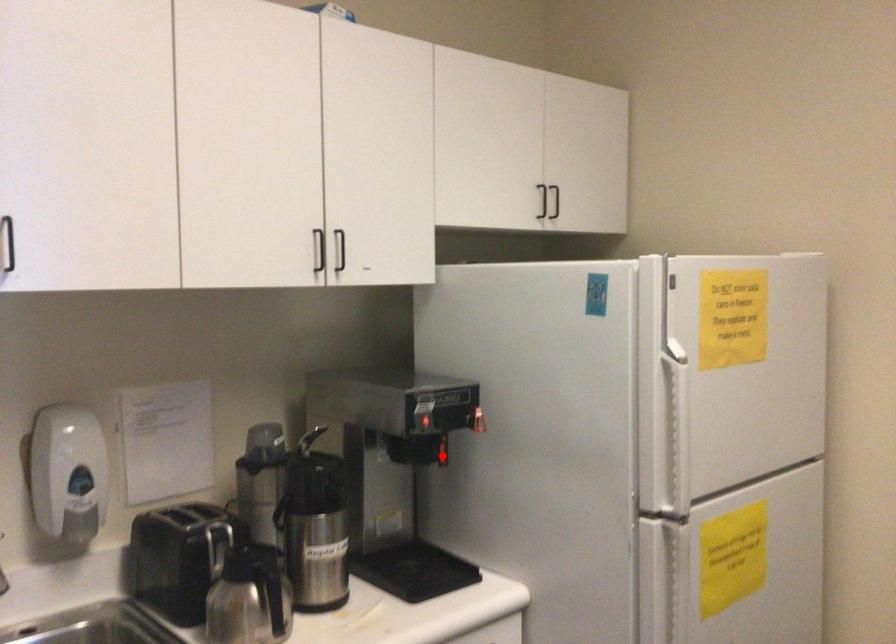
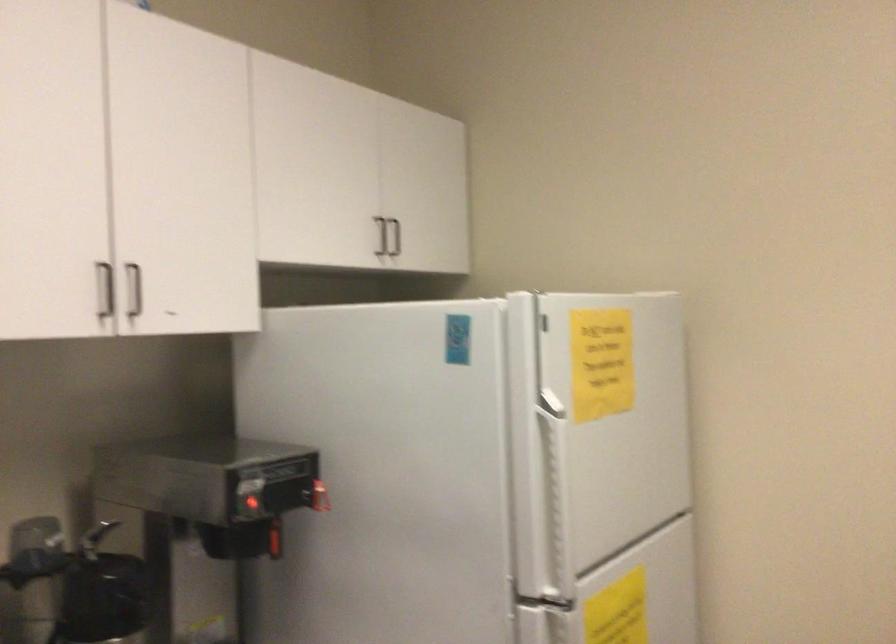
Question: I am providing you with two images of the same scene from different viewpoints. In image1, a red point is highlighted. Considering the same 3D point in image2, which of the following is correct?

Choices:
 (A) It is closer
 (B) It is farther

Answer: (A)